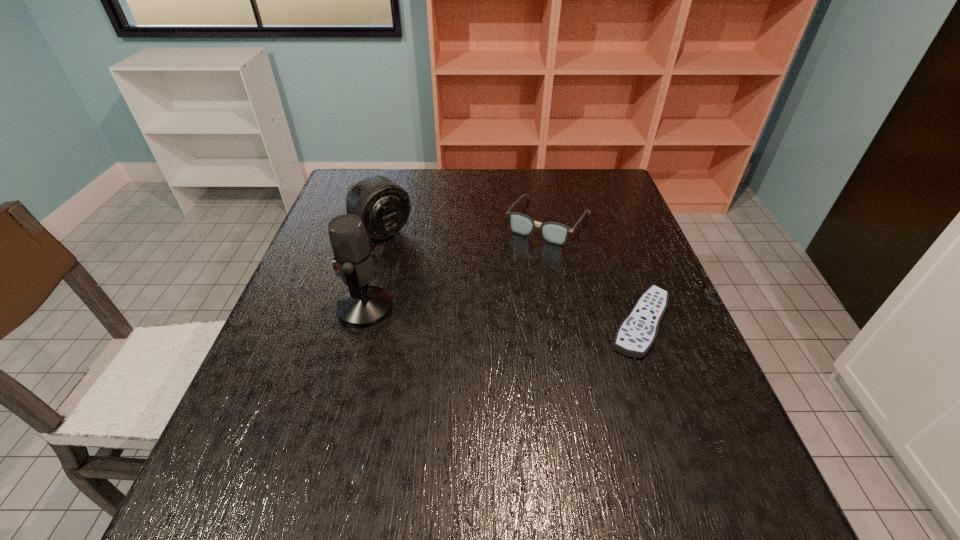
The image size is (960, 540). I want to click on vacant space on the desktop that is between the microphone and the remote control and is positioned on the face of the second shortest object, so click(488, 314).

I want to click on free space on the desktop that is between the tallest object and the remote control and is positioned on the front-facing side of the second tallest object, so click(x=485, y=314).